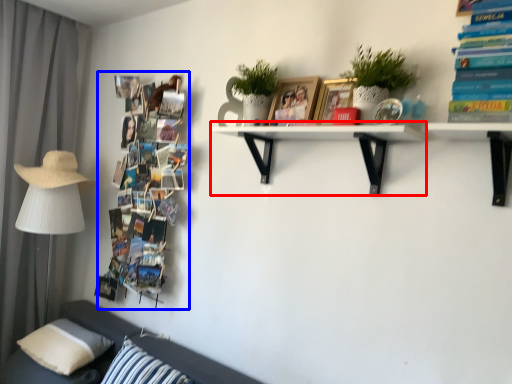
Question: Which point is closer to the camera, shelf (highlighted by a red box) or book (highlighted by a blue box)?

Choices:
 (A) shelf
 (B) book

Answer: (A)